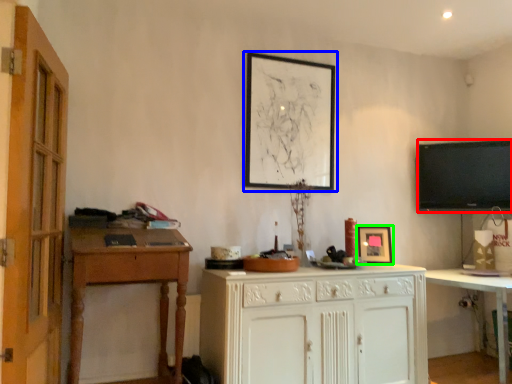
Question: Considering the real-world distances, which object is closest to television (highlighted by a red box)? picture frame (highlighted by a blue box) or picture frame (highlighted by a green box).

Choices:
 (A) picture frame
 (B) picture frame

Answer: (B)